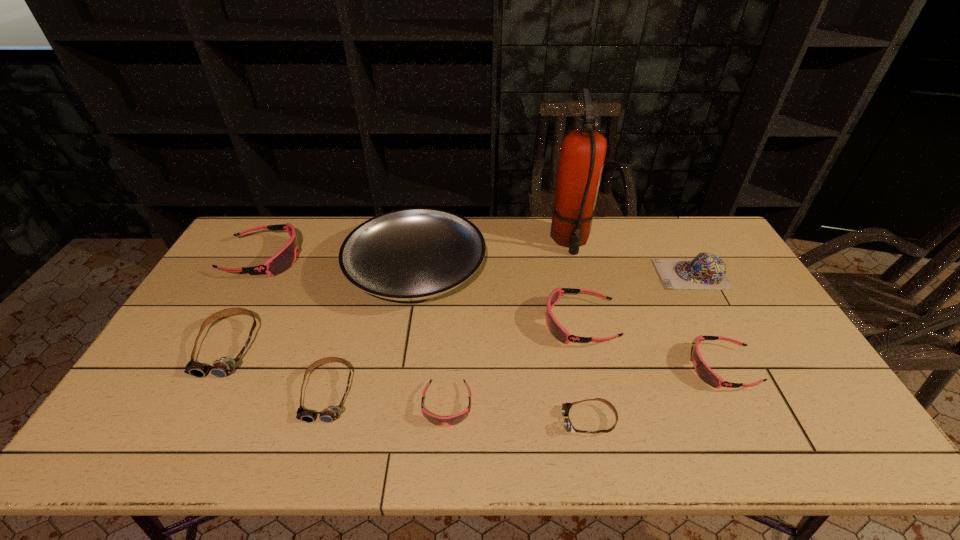
Where is `fire extinguisher positioned at the far edge`? The image size is (960, 540). fire extinguisher positioned at the far edge is located at coordinates (583, 151).

Where is `bedpan situated at the far edge`? This screenshot has width=960, height=540. bedpan situated at the far edge is located at coordinates (410, 254).

Identify the location of goggles that is at the far edge. (284, 259).

Locate an element on the screen. This screenshot has height=540, width=960. cap located in the right edge section of the desktop is located at coordinates (707, 271).

Find the location of a particular element. The height and width of the screenshot is (540, 960). goggles present at the right edge is located at coordinates (703, 371).

You are a GUI agent. You are given a task and a screenshot of the screen. Output one action in this format:
    pyautogui.click(x=<x>, y=<y>)
    Task: Click on the object that is at the far left corner
    
    Given the screenshot: What is the action you would take?
    pyautogui.click(x=284, y=259)

You are a GUI agent. You are given a task and a screenshot of the screen. Output one action in this format:
    pyautogui.click(x=<x>, y=<y>)
    Task: Click on the vacant space at the far edge of the desktop
    
    Given the screenshot: What is the action you would take?
    pyautogui.click(x=334, y=235)

At what (x,y) coordinates should I click in order to perform the action: click on vacant area at the near edge of the desktop. Please return your answer as a coordinate pair (x, y). This screenshot has height=540, width=960. Looking at the image, I should click on (388, 445).

Locate an element on the screen. This screenshot has height=540, width=960. blank space at the left edge of the desktop is located at coordinates point(173,383).

Image resolution: width=960 pixels, height=540 pixels. Find the location of `free space at the right edge`. free space at the right edge is located at coordinates (792, 346).